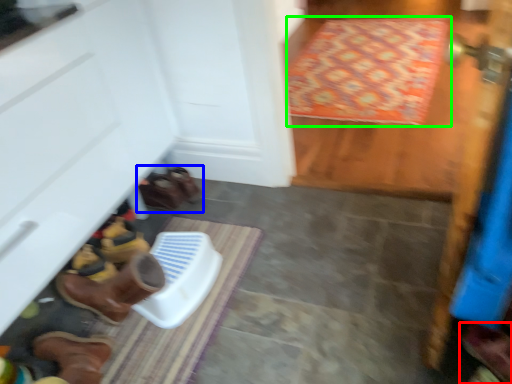
Question: Based on their relative distances, which object is farther from footwear (highlighted by a red box)? Choose from footwear (highlighted by a blue box) and doormat (highlighted by a green box).

Choices:
 (A) footwear
 (B) doormat

Answer: (B)